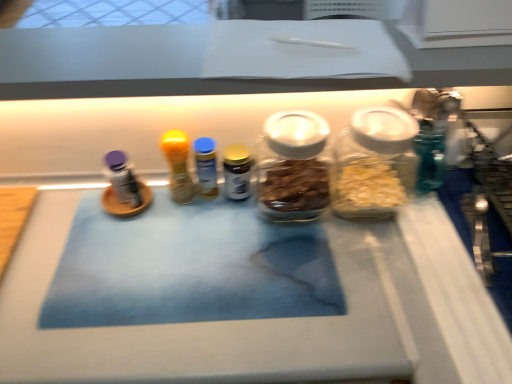
Locate an element on the screen. vacant area to the right of gold metallic spice jar at center, which is counted as the third bottle, starting from the right is located at coordinates (321, 233).